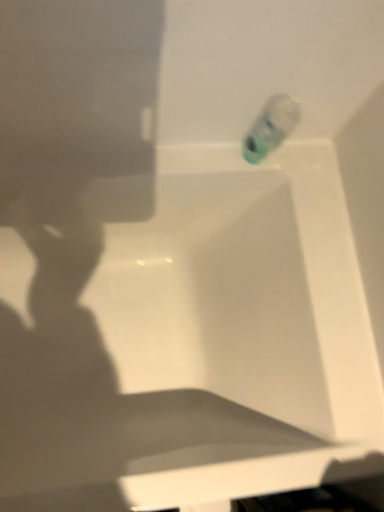
I want to click on vacant space to the right of translucent plastic bottle at upper right, so click(311, 196).